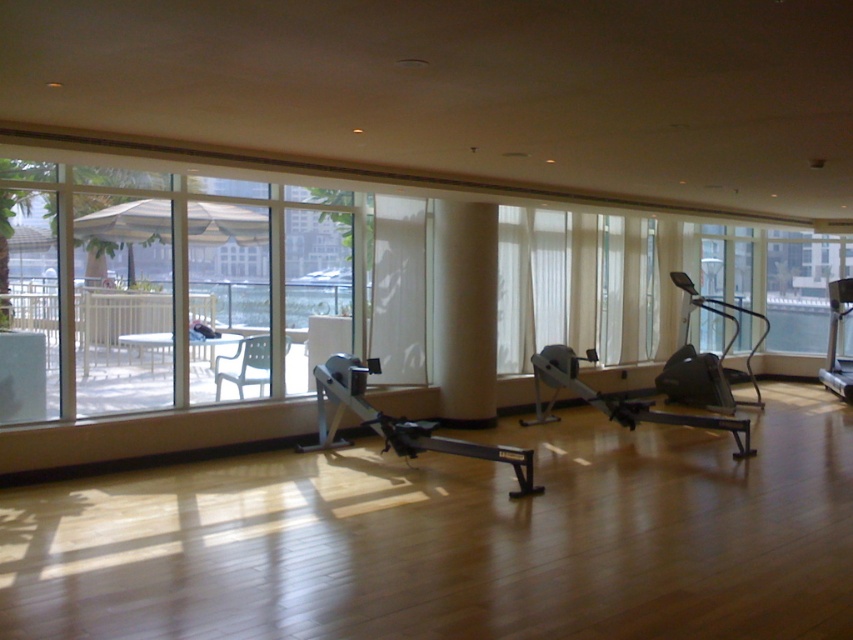
Does white sheer curtain at center have a larger size compared to silver metallic rowing machine at center?

No.

Find the location of a particular element. This screenshot has width=853, height=640. white sheer curtain at center is located at coordinates (399, 289).

Is point (393, 353) positioned behind point (346, 392)?

That is True.

Find the location of a particular element. white sheer curtain at center is located at coordinates [x=399, y=289].

Can you confirm if silver metallic rowing machine at center is smaller than matte black rowing machine at center?

Yes, silver metallic rowing machine at center is smaller than matte black rowing machine at center.

Does silver metallic rowing machine at center appear over matte black rowing machine at center?

Actually, silver metallic rowing machine at center is below matte black rowing machine at center.

Find the location of a particular element. This screenshot has height=640, width=853. silver metallic rowing machine at center is located at coordinates (398, 422).

Measure the distance from silver metallic rowing machine at center to silver metallic treadmill at right.

silver metallic rowing machine at center is 6.98 meters from silver metallic treadmill at right.

Does point (432, 445) come farther from viewer compared to point (827, 365)?

That is False.

Find the location of a particular element. The height and width of the screenshot is (640, 853). silver metallic rowing machine at center is located at coordinates (398, 422).